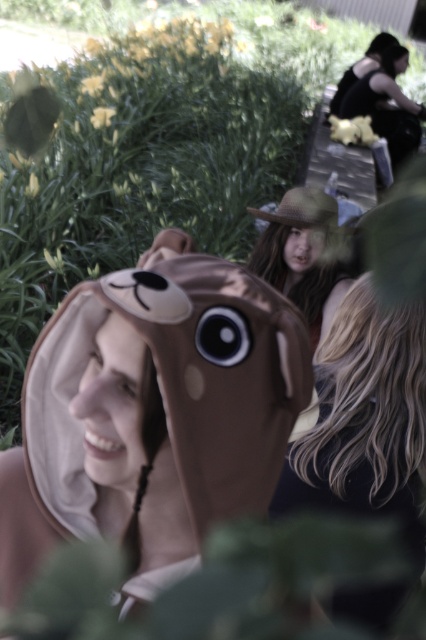
You are standing in the park and see two points in the scene. The first point is at coordinates point (422, 445) and the second is at point (370, 56). Which point is closer to you?

Point (422, 445) is closer to the viewer than point (370, 56).

You are a photographer trying to capture a portrait of the person in the seal costume. You notice the blonde hair at center and the smooth skin face at center. Which of these two features is positioned lower on the person?

The blonde hair at center is positioned below the smooth skin face at center, so the blonde hair is lower.

In the scene shown: You are standing at the point marked as point (365, 419). Which direction should you move to face the person in the seal costume?

The person in the seal costume is positioned to the right of the point (365, 419). Therefore, you should move to your right to face them.